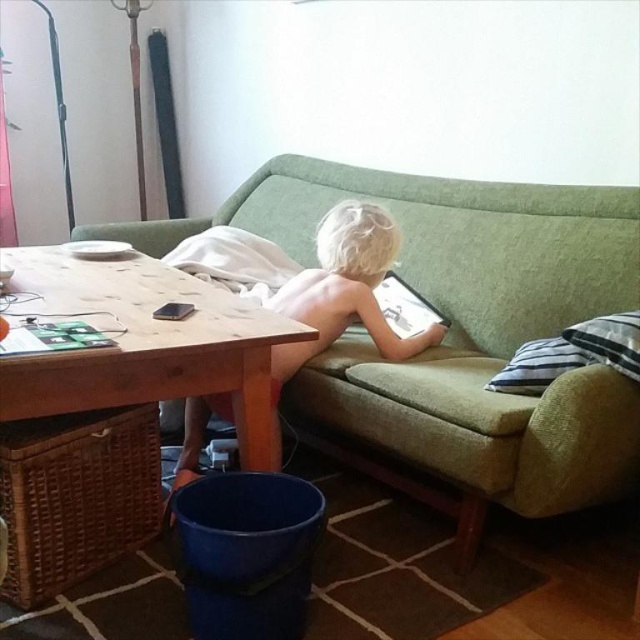
You are a delivery person who needs to place a small package on the green fabric couch at center without disturbing the matte black tablet at center. Based on their positions, where should you place the package?

The green fabric couch at center is positioned on the left side of the matte black tablet at center. Therefore, you should place the small package on the left side of the matte black tablet at center, which is the area occupied by the green fabric couch at center.

You are standing in front of the sofa where the child is sitting. There are two points marked on the sofa. The first point is at coordinates point (294, 312) and the second point is at point (432, 310). Which of these points is closer to you?

Result: Point (294, 312) is closer to the viewer than point (432, 310).